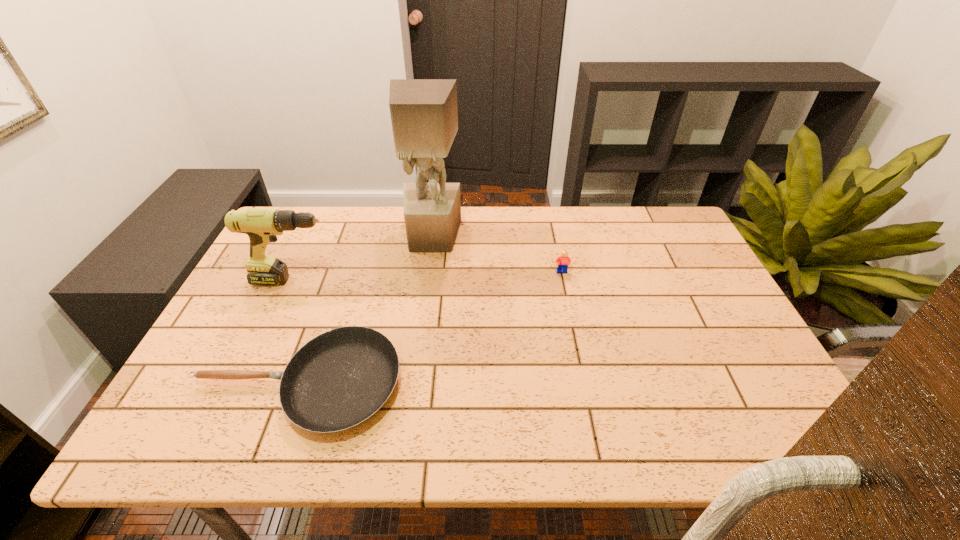
The height and width of the screenshot is (540, 960). I want to click on free spot between the drill and the third tallest object, so click(428, 276).

At what (x,y) coordinates should I click in order to perform the action: click on free point between the third tallest object and the sculpture. Please return your answer as a coordinate pair (x, y). The width and height of the screenshot is (960, 540). Looking at the image, I should click on (497, 254).

Identify which object is located as the nearest to the third tallest object. Please provide its 2D coordinates. Your answer should be formatted as a tuple, i.e. [(x, y)], where the tuple contains the x and y coordinates of a point satisfying the conditions above.

[(424, 115)]

Identify which object is located as the second nearest to the farthest object. Please provide its 2D coordinates. Your answer should be formatted as a tuple, i.e. [(x, y)], where the tuple contains the x and y coordinates of a point satisfying the conditions above.

[(564, 261)]

Find the location of a particular element. The image size is (960, 540). free space in the image that satisfies the following two spatial constraints: 1. on the front-facing side of the farthest object; 2. on the handle side of the third shortest object is located at coordinates (426, 280).

Where is `free spot that satisfies the following two spatial constraints: 1. on the front-facing side of the second shortest object; 2. on the handle side of the second tallest object`? free spot that satisfies the following two spatial constraints: 1. on the front-facing side of the second shortest object; 2. on the handle side of the second tallest object is located at coordinates (564, 280).

Find the location of a particular element. vacant space that satisfies the following two spatial constraints: 1. on the front-facing side of the second shortest object; 2. on the handle side of the third shortest object is located at coordinates (564, 280).

Where is `blank space that satisfies the following two spatial constraints: 1. on the front-facing side of the second shortest object; 2. on the handle side of the second tallest object`? The image size is (960, 540). blank space that satisfies the following two spatial constraints: 1. on the front-facing side of the second shortest object; 2. on the handle side of the second tallest object is located at coordinates (564, 280).

At what (x,y) coordinates should I click in order to perform the action: click on vacant area in the image that satisfies the following two spatial constraints: 1. on the front-facing side of the farthest object; 2. on the handle side of the drill. Please return your answer as a coordinate pair (x, y). The image size is (960, 540). Looking at the image, I should click on (426, 280).

The image size is (960, 540). In order to click on free location that satisfies the following two spatial constraints: 1. on the front-facing side of the tallest object; 2. on the handle side of the drill in this screenshot , I will do `click(426, 280)`.